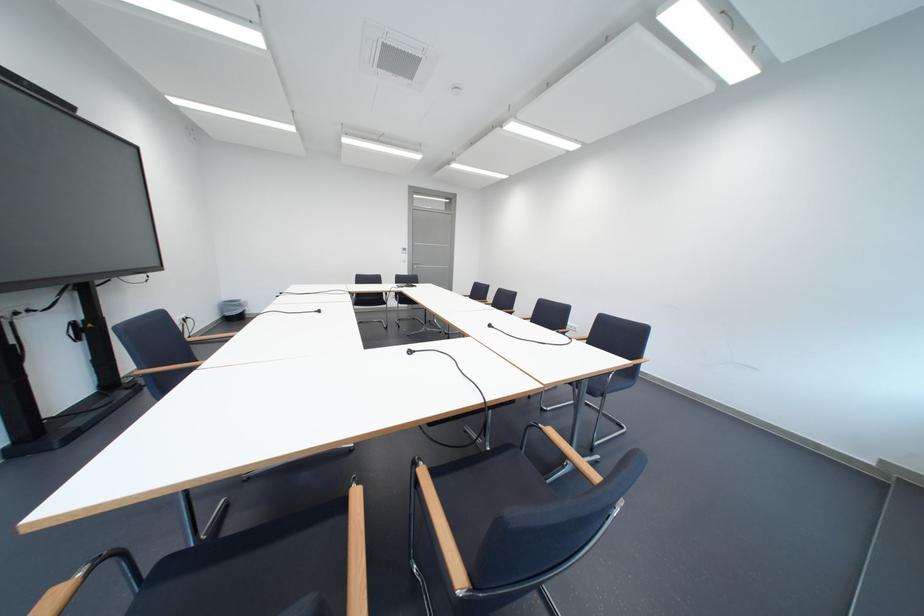
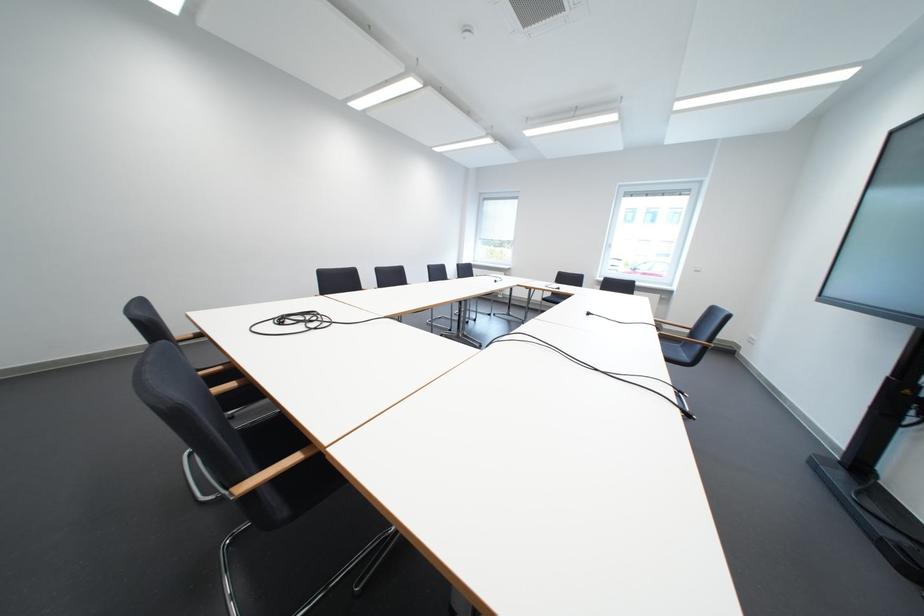
In the second image, find the point that corresponds to (x=332, y=313) in the first image.

(601, 315)